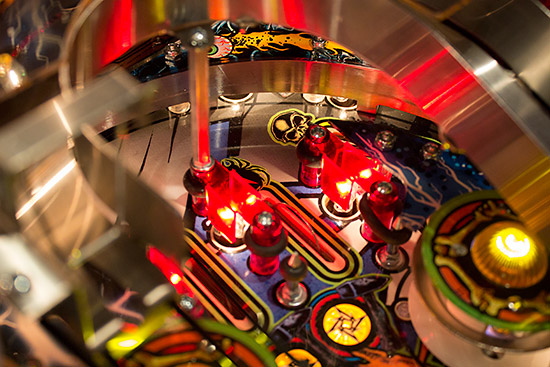
At what (x,y) coordinates should I click in order to perform the action: click on metal shelf. Please return your answer as a coordinate pair (x, y). Image resolution: width=550 pixels, height=367 pixels. Looking at the image, I should click on (471, 140), (495, 77).